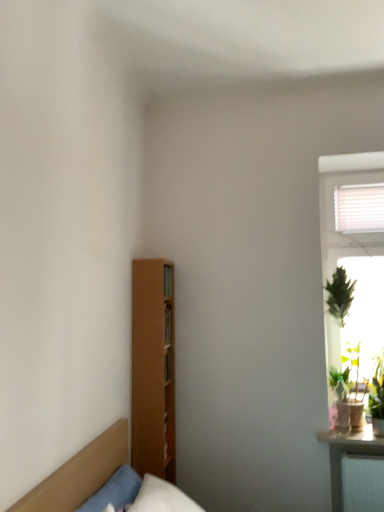
Question: Is green leafy plant at right further to camera compared to brown matte headboard at left?

Choices:
 (A) yes
 (B) no

Answer: (A)

Question: Could you tell me if green leafy plant at right is facing brown matte headboard at left?

Choices:
 (A) no
 (B) yes

Answer: (A)

Question: Are green leafy plant at right and brown matte headboard at left far apart?

Choices:
 (A) no
 (B) yes

Answer: (B)

Question: Is brown matte headboard at left inside green leafy plant at right?

Choices:
 (A) no
 (B) yes

Answer: (A)

Question: From the image's perspective, would you say green leafy plant at right is shown under brown matte headboard at left?

Choices:
 (A) no
 (B) yes

Answer: (B)

Question: Is green leafy plant at right wider than brown matte headboard at left?

Choices:
 (A) yes
 (B) no

Answer: (A)

Question: Is green leafy plant at right a part of brown matte headboard at left?

Choices:
 (A) no
 (B) yes

Answer: (A)

Question: Is green leafy plant at right at the back of brown matte headboard at left?

Choices:
 (A) no
 (B) yes

Answer: (A)

Question: Does brown matte headboard at left lie in front of green leafy plant at right?

Choices:
 (A) no
 (B) yes

Answer: (B)

Question: Is brown matte headboard at left not inside green leafy plant at right?

Choices:
 (A) yes
 (B) no

Answer: (A)

Question: From a real-world perspective, is brown matte headboard at left on green leafy plant at right?

Choices:
 (A) no
 (B) yes

Answer: (A)

Question: Can you confirm if brown matte headboard at left is positioned to the left of green leafy plant at right?

Choices:
 (A) no
 (B) yes

Answer: (B)

Question: Considering the positions of point (319, 437) and point (74, 493), is point (319, 437) closer or farther from the camera than point (74, 493)?

Choices:
 (A) farther
 (B) closer

Answer: (A)